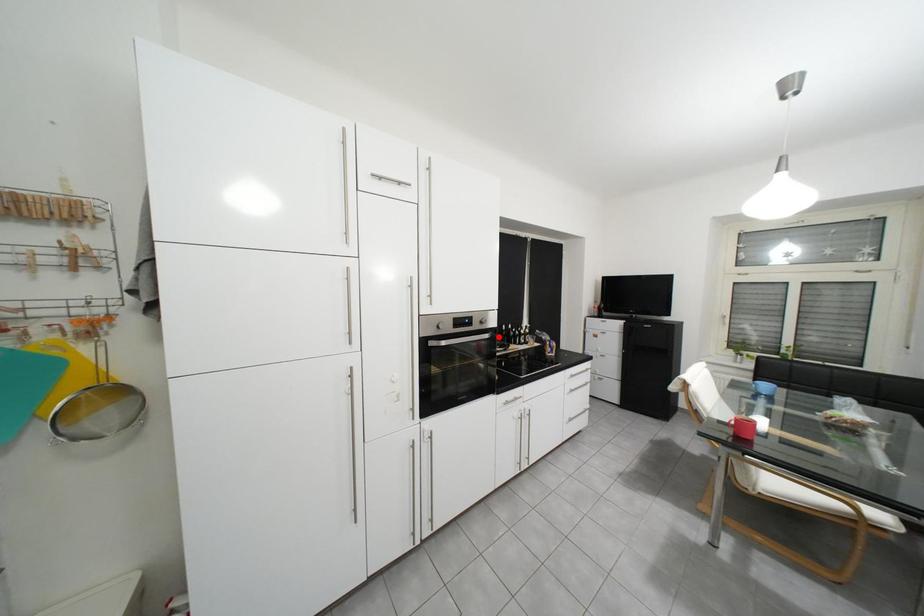
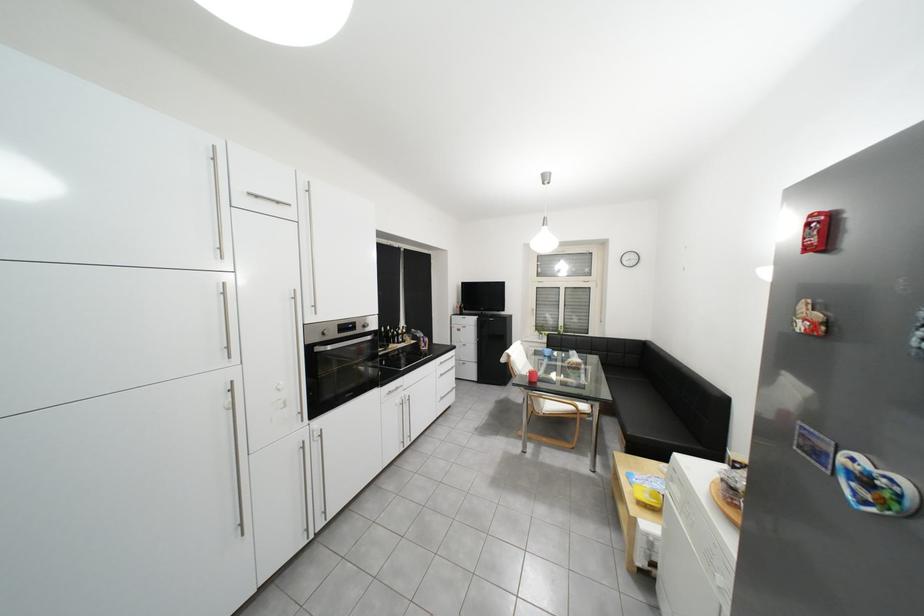
Question: I am providing you with two images of the same scene from different viewpoints. In image1, a red point is highlighted. Considering the same 3D point in image2, which of the following is correct?

Choices:
 (A) It is closer
 (B) It is farther

Answer: (A)